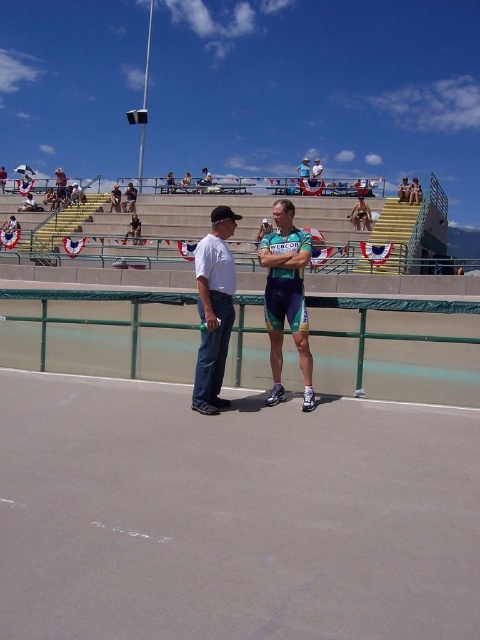
Who is more forward, (144, 304) or (280, 342)?

Point (280, 342) is in front.

The width and height of the screenshot is (480, 640). Identify the location of green metal railing at center. (397, 348).

Locate an element on the screen. This screenshot has height=640, width=480. green metal railing at center is located at coordinates (397, 348).

Does gray asphalt race track at center come in front of green metal railing at center?

Yes, it is in front of green metal railing at center.

Where is `gray asphalt race track at center`? gray asphalt race track at center is located at coordinates (232, 516).

Describe the element at coordinates (232, 516) in the screenshot. I see `gray asphalt race track at center` at that location.

Can you confirm if gray asphalt race track at center is bigger than yellow-green metal bleachers at upper center?

No.

Which is behind, point (362, 584) or point (440, 243)?

The point (440, 243) is more distant.

Where is `gray asphalt race track at center`? gray asphalt race track at center is located at coordinates (232, 516).